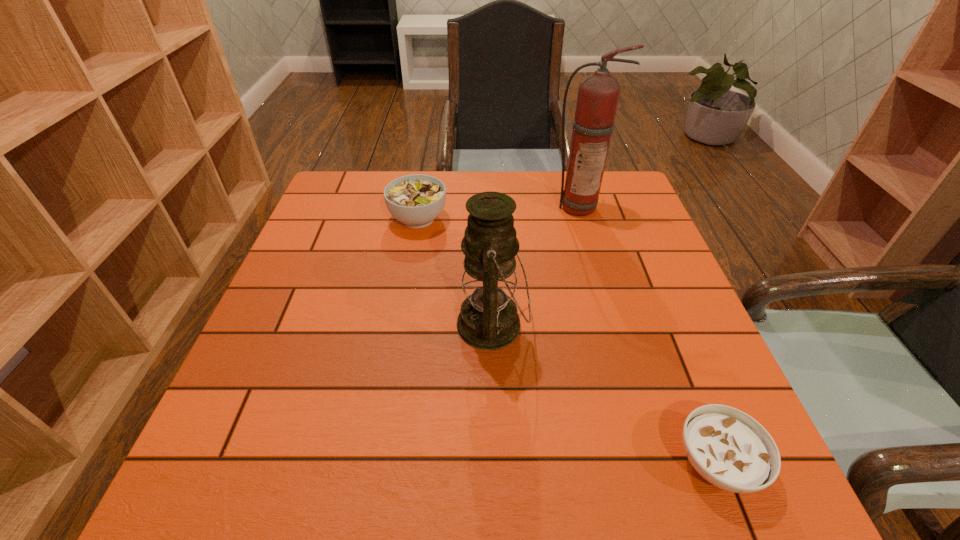
The image size is (960, 540). I want to click on vacant region between the nearer soup bowl and the tallest object, so click(647, 334).

Locate an element on the screen. object that is the closest to the shortest object is located at coordinates click(488, 319).

Identify the location of object that stands as the closest to the third tallest object. (488, 319).

What are the coordinates of `free spot that satisfies the following two spatial constraints: 1. on the side of the nearer soup bowl with the label and nozzle; 2. on the right side of the fire extinguisher` in the screenshot? It's located at (652, 463).

At what (x,y) coordinates should I click in order to perform the action: click on free location that satisfies the following two spatial constraints: 1. on the side of the nearer soup bowl with the label and nozzle; 2. on the right side of the fire extinguisher. Please return your answer as a coordinate pair (x, y). The width and height of the screenshot is (960, 540). Looking at the image, I should click on (652, 463).